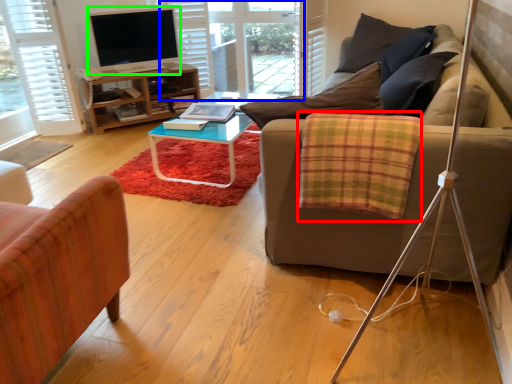
Question: Which is farther away from blanket (highlighted by a red box)? glass door (highlighted by a blue box) or television (highlighted by a green box)?

Choices:
 (A) glass door
 (B) television

Answer: (A)